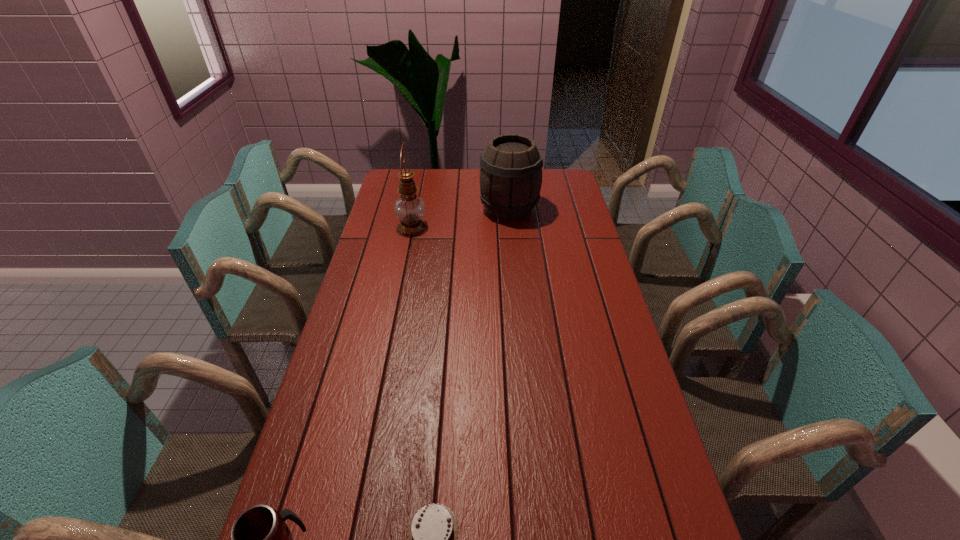
At what (x,y) coordinates should I click in order to perform the action: click on vacant region at the right edge of the desktop. Please return your answer as a coordinate pair (x, y). Looking at the image, I should click on pyautogui.click(x=574, y=320).

Identify the location of empty space between the oil lamp and the second tallest object. (461, 218).

Identify the location of free area in between the third object from right to left and the second tallest object. The image size is (960, 540). (461, 218).

Locate an element on the screen. This screenshot has width=960, height=540. free point between the tallest object and the rightmost object is located at coordinates (461, 218).

Identify the location of object that is the closest to the thermos bottle. This screenshot has width=960, height=540. point(433,530).

This screenshot has width=960, height=540. I want to click on object that stands as the closest to the rightmost object, so click(x=409, y=208).

Find the location of a particular element. The width and height of the screenshot is (960, 540). free point that satisfies the following two spatial constraints: 1. on the back side of the tallest object; 2. on the right side of the wine bucket is located at coordinates (416, 209).